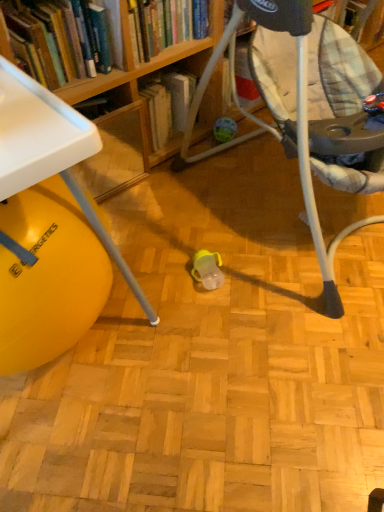
Locate an element on the screen. The width and height of the screenshot is (384, 512). white plastic table at lower left is located at coordinates (48, 228).

What do you see at coordinates (163, 25) in the screenshot? I see `hardcover book at upper left, which is counted as the 2th book, starting from the left` at bounding box center [163, 25].

What do you see at coordinates (309, 113) in the screenshot? Image resolution: width=384 pixels, height=512 pixels. I see `matte plastic baby swing at center` at bounding box center [309, 113].

You are a GUI agent. You are given a task and a screenshot of the screen. Output one action in this format:
    pyautogui.click(x=<x>, y=<y>)
    Task: Click on the white plastic table at lower left
    Image resolution: width=384 pixels, height=512 pixels.
    Given the screenshot: What is the action you would take?
    pyautogui.click(x=48, y=228)

Which is in front, hardcover book at upper left, which is counted as the 2th book, starting from the right, or white plastic table at lower left?

white plastic table at lower left.

Can you confirm if hardcover book at upper left, which is counted as the 2th book, starting from the right, is shorter than white plastic table at lower left?

Indeed, hardcover book at upper left, which is counted as the 2th book, starting from the right, has a lesser height compared to white plastic table at lower left.

Visually, is hardcover book at upper left, which is counted as the 2th book, starting from the right, positioned to the left or to the right of white plastic table at lower left?

In the image, hardcover book at upper left, which is counted as the 2th book, starting from the right, appears on the right side of white plastic table at lower left.

Is white plastic table at lower left positioned with its back to hardcover book at upper left, the first book when ordered from left to right?

No.

Considering the points (30, 306) and (155, 44), which point is in front, point (30, 306) or point (155, 44)?

The point (30, 306) is closer to the camera.

Is white plastic table at lower left inside the boundaries of hardcover book at upper left, the first book when ordered from left to right, or outside?

white plastic table at lower left is not enclosed by hardcover book at upper left, the first book when ordered from left to right.

In the image, is white plastic table at lower left positioned in front of or behind hardcover book at upper left, the first book when ordered from left to right?

white plastic table at lower left is positioned closer to the viewer than hardcover book at upper left, the first book when ordered from left to right.

Would you say matte plastic baby swing at center is part of hardcover book at upper left, which is counted as the 2th book, starting from the left,'s contents?

No, matte plastic baby swing at center is not inside hardcover book at upper left, which is counted as the 2th book, starting from the left.

Would you consider hardcover book at upper left, which is counted as the 2th book, starting from the left, to be distant from matte plastic baby swing at center?

No, hardcover book at upper left, which is counted as the 2th book, starting from the left, is not far away from matte plastic baby swing at center.

Is hardcover book at upper left, which is counted as the 2th book, starting from the left, positioned with its back to matte plastic baby swing at center?

hardcover book at upper left, which is counted as the 2th book, starting from the left, does not have its back to matte plastic baby swing at center.

Is hardcover book at upper left, which is counted as the 2th book, starting from the right, far from matte plastic baby swing at center?

Actually, hardcover book at upper left, which is counted as the 2th book, starting from the right, and matte plastic baby swing at center are a little close together.

Which is closer, (10, 12) or (332, 83)?

Point (10, 12).

Between hardcover book at upper left, which is counted as the 2th book, starting from the right, and matte plastic baby swing at center, which one has smaller size?

hardcover book at upper left, which is counted as the 2th book, starting from the right.

From their relative heights in the image, would you say hardcover book at upper left, which is counted as the 2th book, starting from the right, is taller or shorter than matte plastic baby swing at center?

Clearly, hardcover book at upper left, which is counted as the 2th book, starting from the right, is shorter compared to matte plastic baby swing at center.

Where is `table behind the matte plastic baby swing at center`? table behind the matte plastic baby swing at center is located at coordinates (48, 228).

In the scene shown: Is matte plastic baby swing at center outside of white plastic table at lower left?

matte plastic baby swing at center lies outside white plastic table at lower left's area.

Considering the positions of objects matte plastic baby swing at center and white plastic table at lower left in the image provided, who is more to the left, matte plastic baby swing at center or white plastic table at lower left?

From the viewer's perspective, white plastic table at lower left appears more on the left side.

From a real-world perspective, is matte plastic baby swing at center below white plastic table at lower left?

Incorrect, from a real-world perspective, matte plastic baby swing at center is higher than white plastic table at lower left.

From a real-world perspective, is white plastic table at lower left physically above matte plastic baby swing at center?

No, from a real-world perspective, white plastic table at lower left is not on top of matte plastic baby swing at center.

Can you confirm if white plastic table at lower left is taller than matte plastic baby swing at center?

No.

Identify the location of table behind the matte plastic baby swing at center. (48, 228).

Consider the image. Which of these two, white plastic table at lower left or matte plastic baby swing at center, is bigger?

With larger size is matte plastic baby swing at center.

From a real-world perspective, which object stands above the other?

hardcover book at upper left, the first book when ordered from left to right, from a real-world perspective.

Is hardcover book at upper left, the first book when ordered from left to right, thinner than hardcover book at upper left, the first book from the right?

Indeed, hardcover book at upper left, the first book when ordered from left to right, has a lesser width compared to hardcover book at upper left, the first book from the right.

Which is in front, point (25, 6) or point (187, 17)?

The point (25, 6) is in front.

Measure the distance between hardcover book at upper left, the first book when ordered from left to right, and hardcover book at upper left, which is counted as the 2th book, starting from the left.

hardcover book at upper left, the first book when ordered from left to right, is 3.78 inches away from hardcover book at upper left, which is counted as the 2th book, starting from the left.

Find the location of `table below the hardcover book at upper left, which is counted as the 2th book, starting from the right (from the image's perspective)`. table below the hardcover book at upper left, which is counted as the 2th book, starting from the right (from the image's perspective) is located at coordinates (48, 228).

From a real-world perspective, which book is the 2nd one above the white plastic table at lower left? Please provide its 2D coordinates.

[(59, 38)]

Looking at the image, which one is located further to matte plastic baby swing at center, hardcover book at upper left, which is counted as the 2th book, starting from the left, or hardcover book at upper left, which is counted as the 2th book, starting from the right?

Based on the image, hardcover book at upper left, which is counted as the 2th book, starting from the right, appears to be further to matte plastic baby swing at center.

Which object lies further to the anchor point hardcover book at upper left, which is counted as the 2th book, starting from the right, matte plastic baby swing at center or white plastic table at lower left?

Among the two, white plastic table at lower left is located further to hardcover book at upper left, which is counted as the 2th book, starting from the right.

Looking at the image, which one is located further to hardcover book at upper left, which is counted as the 2th book, starting from the right, white plastic table at lower left or matte plastic baby swing at center?

The object further to hardcover book at upper left, which is counted as the 2th book, starting from the right, is white plastic table at lower left.

Which object lies nearer to the anchor point white plastic table at lower left, hardcover book at upper left, the first book when ordered from left to right, or matte plastic baby swing at center?

Among the two, hardcover book at upper left, the first book when ordered from left to right, is located nearer to white plastic table at lower left.

Based on their spatial positions, is matte plastic baby swing at center or hardcover book at upper left, which is counted as the 2th book, starting from the right, further from white plastic table at lower left?

matte plastic baby swing at center lies further to white plastic table at lower left than the other object.

Estimate the real-world distances between objects in this image. Which object is closer to white plastic table at lower left, hardcover book at upper left, the first book from the right, or matte plastic baby swing at center?

matte plastic baby swing at center is closer to white plastic table at lower left.

Consider the image. Considering their positions, is white plastic table at lower left positioned closer to matte plastic baby swing at center than hardcover book at upper left, the first book from the right?

hardcover book at upper left, the first book from the right.

Looking at the image, which one is located further to hardcover book at upper left, which is counted as the 2th book, starting from the left, hardcover book at upper left, the first book when ordered from left to right, or white plastic table at lower left?

white plastic table at lower left is further to hardcover book at upper left, which is counted as the 2th book, starting from the left.

Where is `book between hardcover book at upper left, which is counted as the 2th book, starting from the left, and white plastic table at lower left in the up-down direction`? This screenshot has height=512, width=384. book between hardcover book at upper left, which is counted as the 2th book, starting from the left, and white plastic table at lower left in the up-down direction is located at coordinates (59, 38).

Identify the location of book between hardcover book at upper left, the first book when ordered from left to right, and matte plastic baby swing at center from left to right. The width and height of the screenshot is (384, 512). (163, 25).